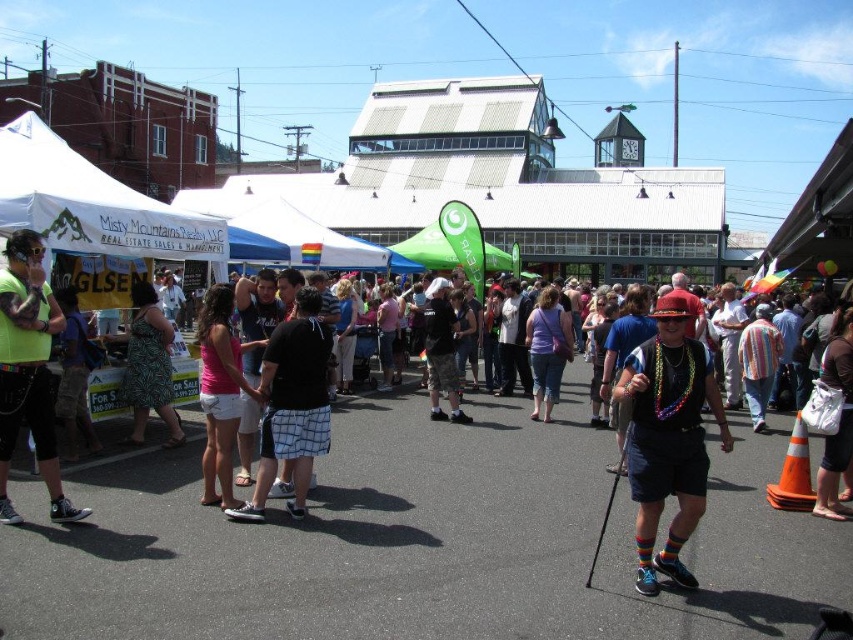
Question: Which is farther from the purple fabric shirt at center?

Choices:
 (A) matte neon green shirt at left
 (B) pink fabric shorts at center
 (C) black cotton shirt at center
 (D) rainbow striped socks at center

Answer: (A)

Question: Does matte neon green shirt at left appear over black cotton shirt at center?

Choices:
 (A) no
 (B) yes

Answer: (A)

Question: Is pink fabric shorts at center wider than black cotton shirt at center?

Choices:
 (A) no
 (B) yes

Answer: (B)

Question: Which point is closer to the camera taking this photo?

Choices:
 (A) (177, 444)
 (B) (42, 419)
 (C) (552, 371)
 (D) (437, 365)

Answer: (B)

Question: Which point is farther from the camera taking this photo?

Choices:
 (A) (636, 480)
 (B) (431, 289)

Answer: (B)

Question: Can you confirm if pink fabric shorts at center is positioned above green printed dress at center?

Choices:
 (A) yes
 (B) no

Answer: (B)